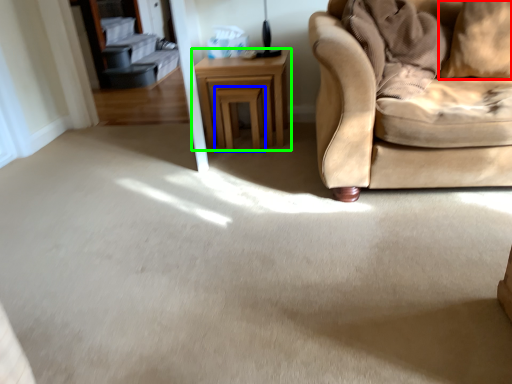
Question: Based on their relative distances, which object is nearer to pillow (highlighted by a red box)? Choose from stool (highlighted by a blue box) and table (highlighted by a green box).

Choices:
 (A) stool
 (B) table

Answer: (B)